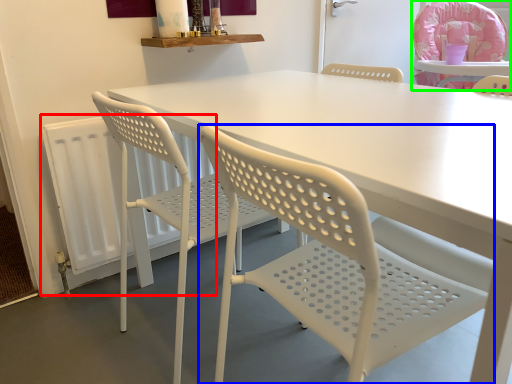
Question: Which is farther away from radiator (highlighted by a red box)? chair (highlighted by a blue box) or chair (highlighted by a green box)?

Choices:
 (A) chair
 (B) chair

Answer: (B)